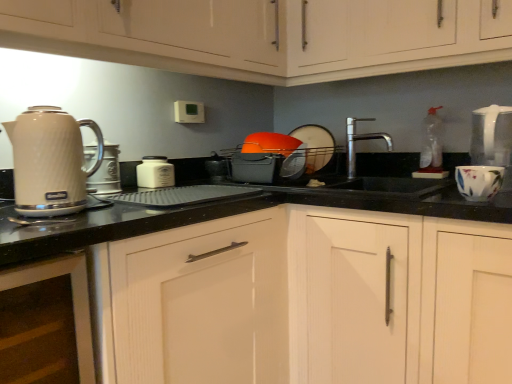
Question: Is white wood cabinet at center, the 4th cabinetry when ordered from top to bottom, spatially inside matte white kettle at left, or outside of it?

Choices:
 (A) outside
 (B) inside

Answer: (A)

Question: Is white wood cabinet at center, placed as the 1th cabinetry when sorted from bottom to top, to the left or to the right of matte white kettle at left in the image?

Choices:
 (A) right
 (B) left

Answer: (A)

Question: Estimate the real-world distances between objects in this image. Which object is farther from the floral ceramic mug at right?

Choices:
 (A) matte white cabinet at upper center, the third cabinetry from the bottom
 (B) white wood cabinet at lower left, which is counted as the 3th cabinetry, starting from the top
 (C) polished stainless steel faucet at center
 (D) white matte jar at center, which is the 2th kitchen appliance in left-to-right order
 (E) matte white kettle at left

Answer: (D)

Question: Which of these objects is positioned farthest from the black plastic tray at center, acting as the 1th appliance starting from the bottom?

Choices:
 (A) white wood cabinet at center, the 4th cabinetry when ordered from top to bottom
 (B) matte white cabinet at upper center, the third cabinetry from the bottom
 (C) floral ceramic mug at right
 (D) white wood cabinet at lower left, which is counted as the 3th cabinetry, starting from the top
 (E) matte white kettle at left

Answer: (C)